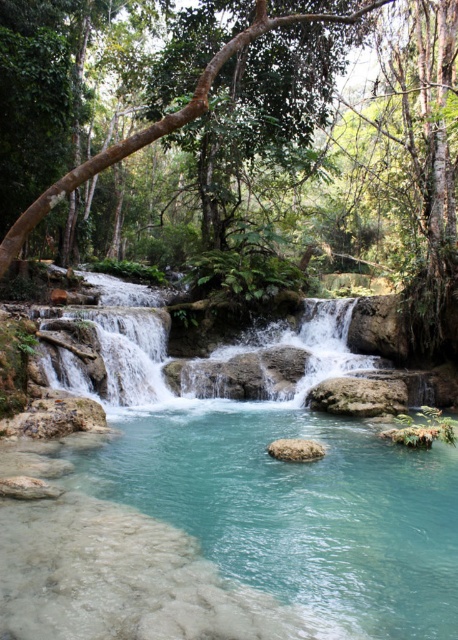
Image resolution: width=458 pixels, height=640 pixels. What do you see at coordinates (168, 116) in the screenshot?
I see `brown rough tree at center` at bounding box center [168, 116].

Does brown rough tree at center have a greater width compared to smooth gray rock at center?

Correct, the width of brown rough tree at center exceeds that of smooth gray rock at center.

Who is more forward, (x=110, y=154) or (x=311, y=451)?

Point (x=110, y=154) is more forward.

Find the location of `brown rough tree at center`. brown rough tree at center is located at coordinates (168, 116).

Is point (107, 320) behind point (300, 444)?

Yes, it is.

In the scene shown: Between clear stone waterfall at center and smooth gray rock at center, which one is positioned lower?

smooth gray rock at center is below.

Is point (114, 390) more distant than point (279, 458)?

Yes, point (114, 390) is behind point (279, 458).

Identify the location of clear stone waterfall at center. The height and width of the screenshot is (640, 458). (129, 340).

Identify the location of clear glass stream at center. (296, 509).

Who is lower down, clear glass stream at center or brown rough tree at center?

Positioned lower is clear glass stream at center.

This screenshot has height=640, width=458. Identify the location of clear glass stream at center. (296, 509).